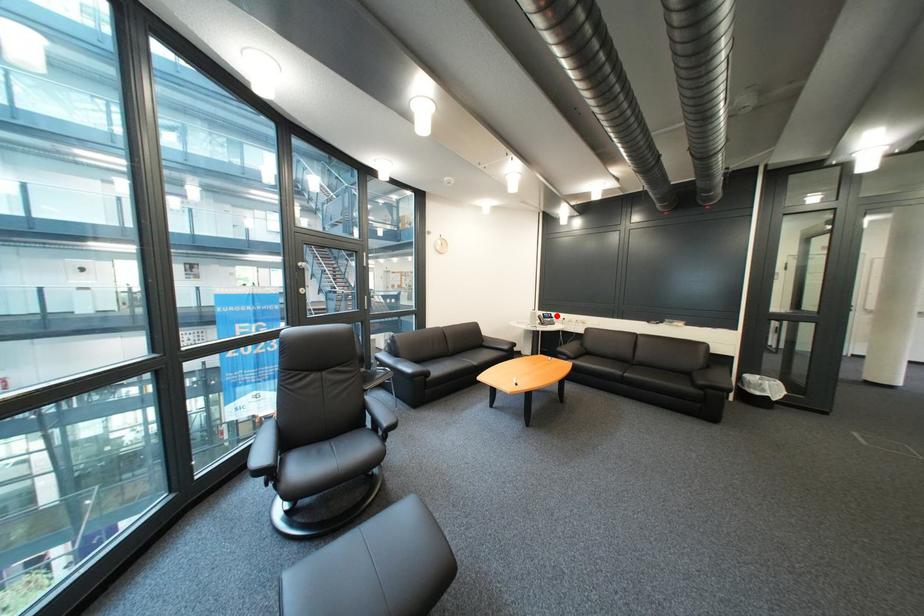
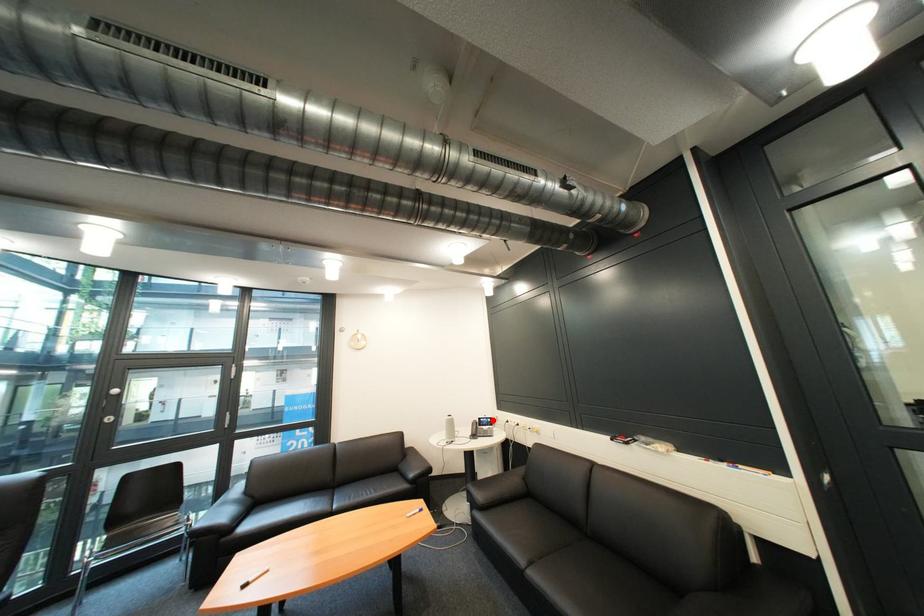
I am providing you with two images of the same scene from different viewpoints. A red point is marked on the first image and another point is marked on the second image. Does the point marked in image1 correspond to the same location as the one in image2?

Yes